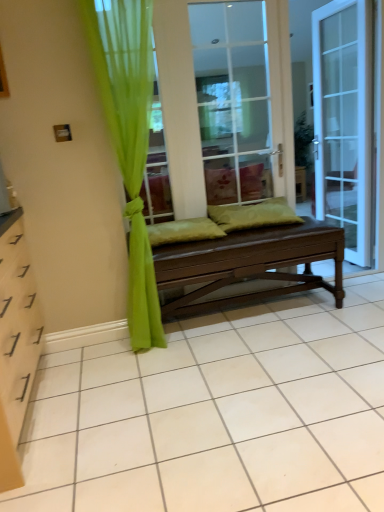
Question: In which direction should I rotate to look at green fabric pillow at center, positioned as the 2th pillow in left-to-right order?

Choices:
 (A) left
 (B) right

Answer: (B)

Question: Is green fabric pillow at center, the first pillow when ordered from right to left, further to camera compared to brown wooden bench at center?

Choices:
 (A) yes
 (B) no

Answer: (A)

Question: Considering the relative sizes of green fabric pillow at center, positioned as the 2th pillow in left-to-right order, and brown wooden bench at center in the image provided, is green fabric pillow at center, positioned as the 2th pillow in left-to-right order, taller than brown wooden bench at center?

Choices:
 (A) no
 (B) yes

Answer: (A)

Question: Is green fabric pillow at center, positioned as the 2th pillow in left-to-right order, positioned in front of brown wooden bench at center?

Choices:
 (A) yes
 (B) no

Answer: (B)

Question: Is green fabric pillow at center, the first pillow when ordered from right to left, turned away from brown wooden bench at center?

Choices:
 (A) yes
 (B) no

Answer: (A)

Question: From a real-world perspective, is green fabric pillow at center, positioned as the 2th pillow in left-to-right order, located beneath brown wooden bench at center?

Choices:
 (A) yes
 (B) no

Answer: (A)

Question: Is green fabric pillow at center, positioned as the 2th pillow in left-to-right order, thinner than brown wooden bench at center?

Choices:
 (A) no
 (B) yes

Answer: (A)

Question: Considering the relative sizes of brown wooden bench at center and green fabric pillow at center, which is the first pillow in left-to-right order, in the image provided, is brown wooden bench at center bigger than green fabric pillow at center, which is the first pillow in left-to-right order,?

Choices:
 (A) no
 (B) yes

Answer: (B)

Question: From a real-world perspective, is brown wooden bench at center positioned over green fabric pillow at center, the second pillow viewed from the right, based on gravity?

Choices:
 (A) yes
 (B) no

Answer: (A)

Question: Could you tell me if brown wooden bench at center is facing green fabric pillow at center, the second pillow viewed from the right?

Choices:
 (A) no
 (B) yes

Answer: (A)

Question: Considering the relative sizes of brown wooden bench at center and green fabric pillow at center, the second pillow viewed from the right, in the image provided, is brown wooden bench at center thinner than green fabric pillow at center, the second pillow viewed from the right,?

Choices:
 (A) yes
 (B) no

Answer: (A)

Question: Can you confirm if brown wooden bench at center is smaller than green fabric pillow at center, which is the first pillow in left-to-right order?

Choices:
 (A) no
 (B) yes

Answer: (A)

Question: Does brown wooden bench at center come behind green fabric pillow at center, which is the first pillow in left-to-right order?

Choices:
 (A) no
 (B) yes

Answer: (B)

Question: Can you confirm if green sheer curtain at left is shorter than green fabric pillow at center, which is the first pillow in left-to-right order?

Choices:
 (A) no
 (B) yes

Answer: (A)